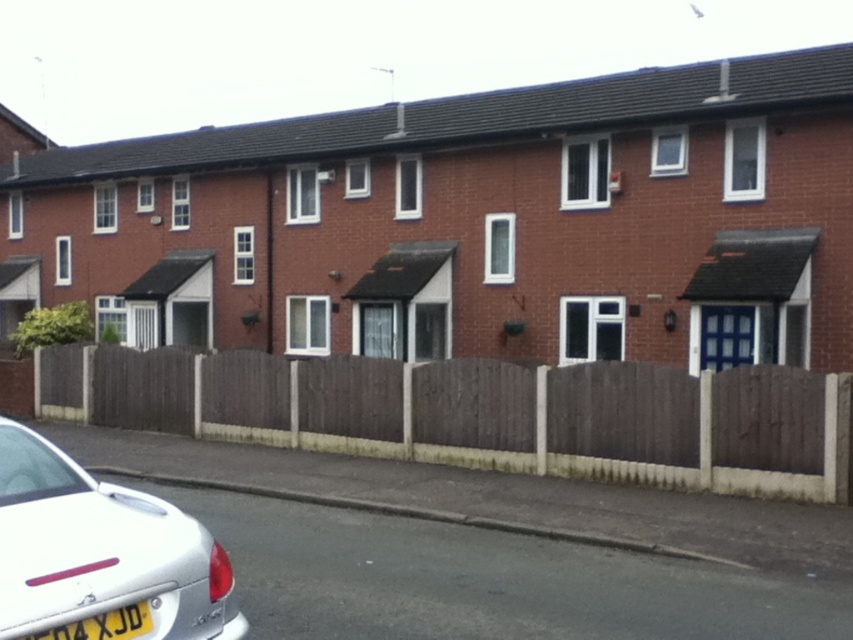
You are a delivery person trying to park your 13.5 inches wide package cart between the white glossy car at lower left and the yellow plastic license plate at lower left. Can you fit your cart in that space?

The distance between the white glossy car at lower left and the yellow plastic license plate at lower left is 13.46 inches. Since your package cart is 13.5 inches wide, it is slightly wider than the available space. You cannot fit your cart in that space.

You are standing on the street in front of the terraced houses and want to take a photo that includes both the point at coordinate (292, 378) and the point at coordinate (134, 618). Which point should be closer to the camera in your photo?

Point (134, 618) should be closer to the camera in your photo because it is closer to the photographer than point (292, 378), which is further away.

You are a delivery person trying to park your 2.5 meter wide delivery van between the brown wooden fence at lower left and the white glossy car at lower left. Based on the scene, can you fit your van in that space?

The brown wooden fence at lower left is larger in size compared to the white glossy car at lower left. However, the exact width of the space between them isn